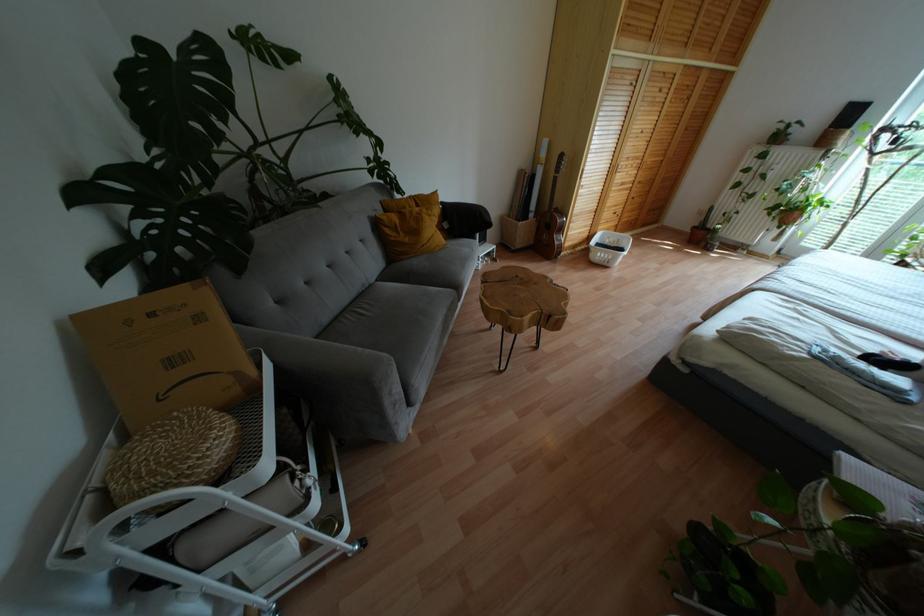
This screenshot has width=924, height=616. Describe the element at coordinates (314, 353) in the screenshot. I see `the grey sofa armrest` at that location.